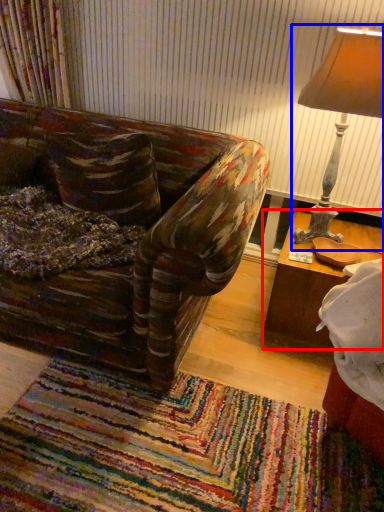
Question: Which object is further to the camera taking this photo, table (highlighted by a red box) or lamp (highlighted by a blue box)?

Choices:
 (A) table
 (B) lamp

Answer: (A)